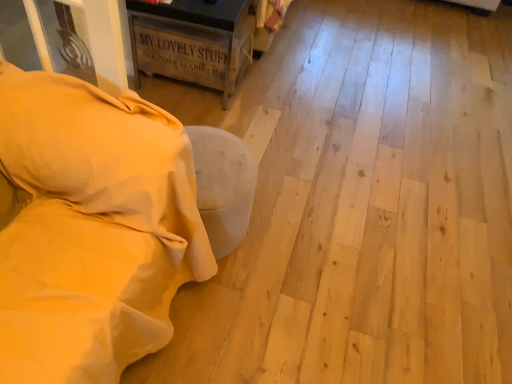
Question: Is beige soft pillow at left at the right side of beige fabric ottoman at lower left, the second furniture when ordered from back to front?

Choices:
 (A) yes
 (B) no

Answer: (B)

Question: Considering the relative sizes of beige soft pillow at left and beige fabric ottoman at lower left, the first furniture in the front-to-back sequence, in the image provided, is beige soft pillow at left thinner than beige fabric ottoman at lower left, the first furniture in the front-to-back sequence,?

Choices:
 (A) yes
 (B) no

Answer: (A)

Question: Does beige soft pillow at left have a greater width compared to beige fabric ottoman at lower left, the first furniture in the front-to-back sequence?

Choices:
 (A) yes
 (B) no

Answer: (B)

Question: From a real-world perspective, is beige soft pillow at left physically above beige fabric ottoman at lower left, the first furniture in the front-to-back sequence?

Choices:
 (A) yes
 (B) no

Answer: (A)

Question: Is beige soft pillow at left not close to beige fabric ottoman at lower left, positioned as the 1th furniture in bottom-to-top order?

Choices:
 (A) yes
 (B) no

Answer: (B)

Question: From a real-world perspective, is beige soft pillow at left under beige fabric ottoman at lower left, positioned as the 1th furniture in bottom-to-top order?

Choices:
 (A) no
 (B) yes

Answer: (A)

Question: Is rustic wood crate at upper left, which is the 2th furniture from bottom to top, oriented away from beige fabric ottoman at lower left, the second furniture when ordered from back to front?

Choices:
 (A) no
 (B) yes

Answer: (A)

Question: Can you confirm if rustic wood crate at upper left, which is counted as the first furniture, starting from the back, is taller than beige fabric ottoman at lower left, which ranks as the second furniture in top-to-bottom order?

Choices:
 (A) yes
 (B) no

Answer: (B)

Question: Would you say rustic wood crate at upper left, which is the first furniture from top to bottom, is outside beige fabric ottoman at lower left, positioned as the 1th furniture in bottom-to-top order?

Choices:
 (A) yes
 (B) no

Answer: (A)

Question: Does rustic wood crate at upper left, which is counted as the 2th furniture, starting from the front, have a lesser height compared to beige fabric ottoman at lower left, positioned as the 1th furniture in bottom-to-top order?

Choices:
 (A) yes
 (B) no

Answer: (A)

Question: From a real-world perspective, is rustic wood crate at upper left, which is the 2th furniture from bottom to top, beneath beige fabric ottoman at lower left, the second furniture when ordered from back to front?

Choices:
 (A) no
 (B) yes

Answer: (B)

Question: Does rustic wood crate at upper left, which is counted as the 2th furniture, starting from the front, appear on the right side of beige fabric ottoman at lower left, positioned as the 1th furniture in bottom-to-top order?

Choices:
 (A) yes
 (B) no

Answer: (A)

Question: Could rustic wood crate at upper left, which is the first furniture from top to bottom, be considered to be inside beige fabric ottoman at lower left, which ranks as the second furniture in top-to-bottom order?

Choices:
 (A) no
 (B) yes

Answer: (A)